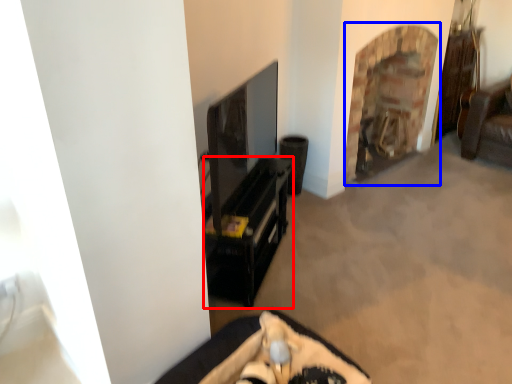
Question: Which point is closer to the camera, furniture (highlighted by a red box) or fireplace (highlighted by a blue box)?

Choices:
 (A) furniture
 (B) fireplace

Answer: (A)